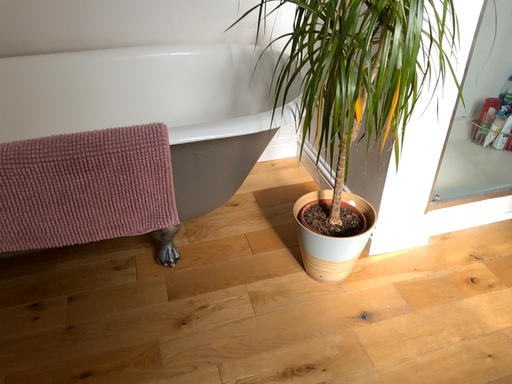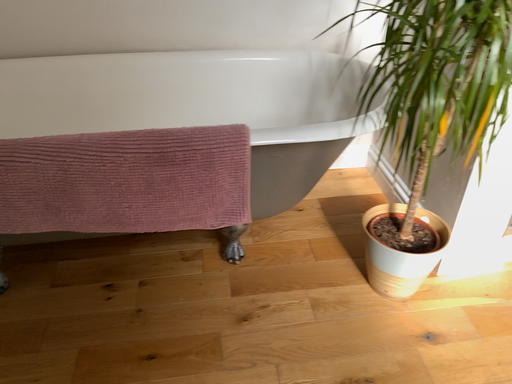
Question: How did the camera likely rotate when shooting the video?

Choices:
 (A) rotated left
 (B) rotated right

Answer: (A)